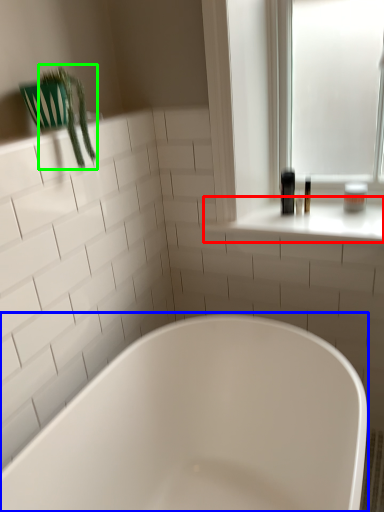
Question: Which object is the closest to the window sill (highlighted by a red box)? Choose among these: bathtub (highlighted by a blue box) or plant (highlighted by a green box).

Choices:
 (A) bathtub
 (B) plant

Answer: (A)